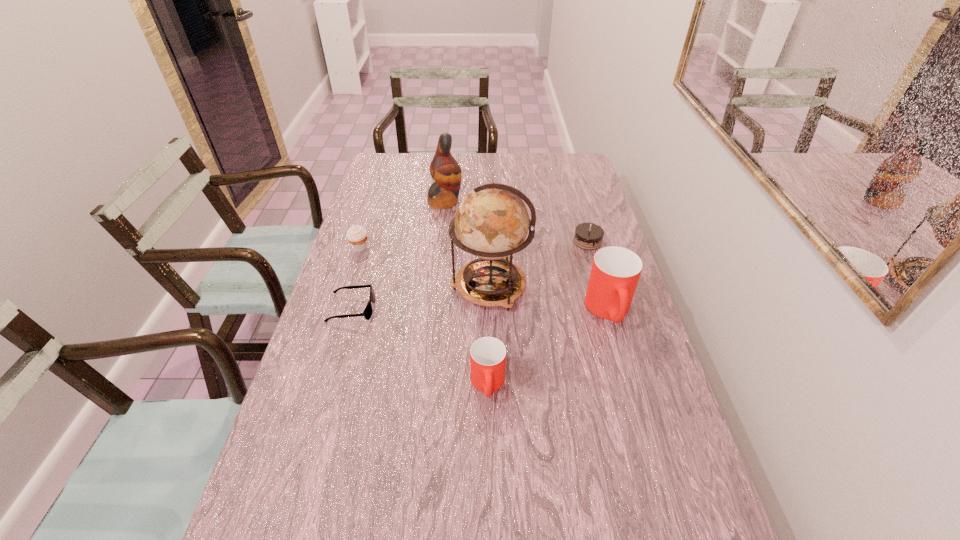
Locate an element on the screen. sunglasses located at the left edge is located at coordinates (368, 310).

Image resolution: width=960 pixels, height=540 pixels. In order to click on cup present at the right edge in this screenshot , I will do `click(615, 272)`.

Where is `chocolate cake at the right edge`? The width and height of the screenshot is (960, 540). chocolate cake at the right edge is located at coordinates (588, 236).

The height and width of the screenshot is (540, 960). In the image, there is a desktop. Identify the location of blank space at the far edge. (522, 177).

Where is `vacant space at the near edge`? This screenshot has width=960, height=540. vacant space at the near edge is located at coordinates (547, 519).

In the image, there is a desktop. Identify the location of vacant space at the left edge. (342, 459).

Find the location of a particular element. The height and width of the screenshot is (540, 960). vacant space at the right edge is located at coordinates (633, 471).

Identify the location of vacant space at the far right corner of the desktop. This screenshot has height=540, width=960. (545, 158).

You are a GUI agent. You are given a task and a screenshot of the screen. Output one action in this format:
    pyautogui.click(x=<x>, y=<y>)
    Task: Click on the vacant space that's between the muffin and the sixth shortest object
    The image size is (960, 540).
    Given the screenshot: What is the action you would take?
    pyautogui.click(x=402, y=225)

The image size is (960, 540). In order to click on free space between the shortest object and the third shortest object in this screenshot , I will do `click(356, 278)`.